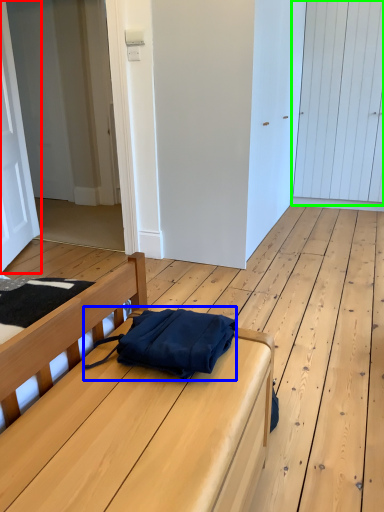
Question: Which object is positioned closest to door (highlighted by a red box)? Select from messenger bag (highlighted by a blue box) and door (highlighted by a green box).

Choices:
 (A) messenger bag
 (B) door

Answer: (A)